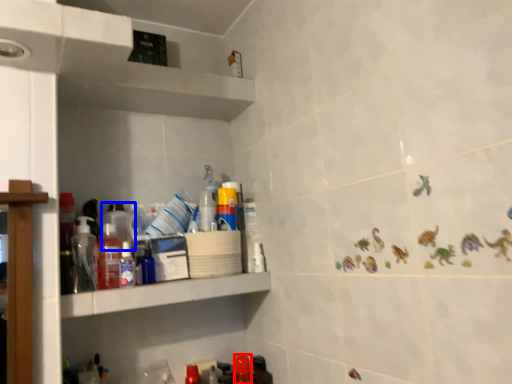
Question: Which of the following is the closest to the observer, bottle (highlighted by a red box) or bottle (highlighted by a blue box)?

Choices:
 (A) bottle
 (B) bottle

Answer: (B)